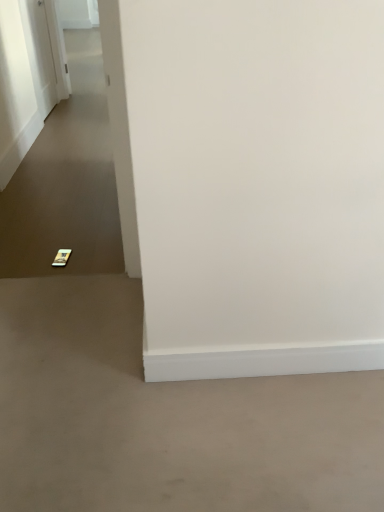
Question: Does gold metallic phone at lower left have a lesser height compared to gray matte concrete at lower left?

Choices:
 (A) yes
 (B) no

Answer: (A)

Question: Is gold metallic phone at lower left thinner than gray matte concrete at lower left?

Choices:
 (A) no
 (B) yes

Answer: (A)

Question: Is gold metallic phone at lower left facing towards gray matte concrete at lower left?

Choices:
 (A) no
 (B) yes

Answer: (B)

Question: Can you confirm if gold metallic phone at lower left is smaller than gray matte concrete at lower left?

Choices:
 (A) no
 (B) yes

Answer: (A)

Question: Does gold metallic phone at lower left appear on the right side of gray matte concrete at lower left?

Choices:
 (A) yes
 (B) no

Answer: (B)

Question: Is white glossy door at upper left in front of or behind gold metallic phone at lower left in the image?

Choices:
 (A) behind
 (B) front

Answer: (A)

Question: Considering the positions of point (39, 25) and point (21, 233), is point (39, 25) closer or farther from the camera than point (21, 233)?

Choices:
 (A) farther
 (B) closer

Answer: (A)

Question: From a real-world perspective, is white glossy door at upper left positioned above or below gold metallic phone at lower left?

Choices:
 (A) below
 (B) above

Answer: (B)

Question: From the image's perspective, is white glossy door at upper left positioned above or below gold metallic phone at lower left?

Choices:
 (A) above
 (B) below

Answer: (A)

Question: Considering the positions of gold metallic phone at lower left and white glossy door at upper left in the image, is gold metallic phone at lower left taller or shorter than white glossy door at upper left?

Choices:
 (A) short
 (B) tall

Answer: (A)

Question: Is point (61, 228) positioned closer to the camera than point (39, 27)?

Choices:
 (A) farther
 (B) closer

Answer: (B)

Question: In terms of size, does gold metallic phone at lower left appear bigger or smaller than white glossy door at upper left?

Choices:
 (A) big
 (B) small

Answer: (A)

Question: From a real-world perspective, is gold metallic phone at lower left positioned above or below white glossy door at upper left?

Choices:
 (A) above
 (B) below

Answer: (B)

Question: Is gray matte concrete at lower left taller or shorter than white glossy door at upper left?

Choices:
 (A) tall
 (B) short

Answer: (B)

Question: From a real-world perspective, is gray matte concrete at lower left physically located above or below white glossy door at upper left?

Choices:
 (A) above
 (B) below

Answer: (B)